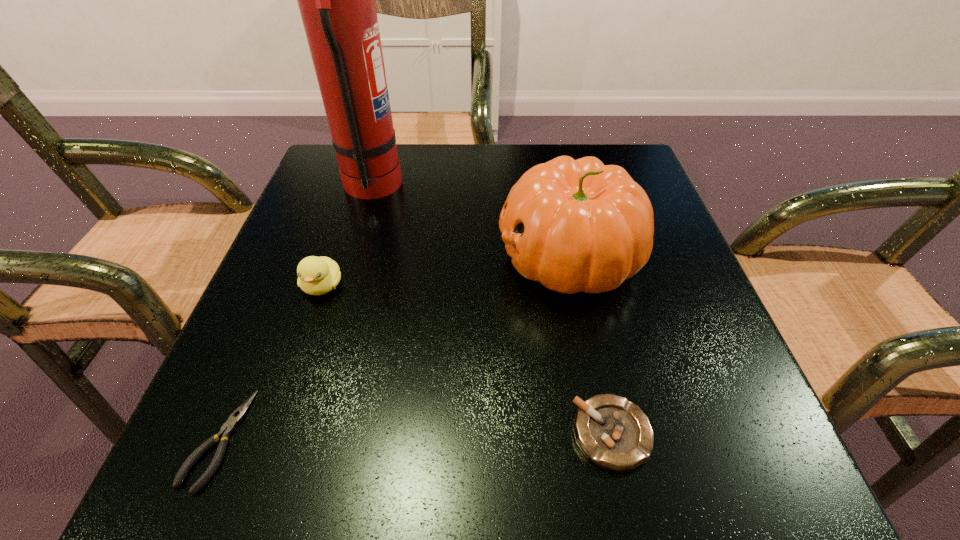
The image size is (960, 540). Find the location of `free space at the far right corner of the desktop`. free space at the far right corner of the desktop is located at coordinates (587, 152).

The image size is (960, 540). What are the coordinates of `vacant space at the near right corner of the desktop` in the screenshot? It's located at (672, 462).

This screenshot has height=540, width=960. I want to click on empty space that is in between the shortest object and the farthest object, so click(295, 313).

Identify the location of vacant area that lies between the ashtray and the pliers. (415, 437).

Find the location of a particular element. The width and height of the screenshot is (960, 540). vacant region between the ashtray and the fire extinguisher is located at coordinates (492, 310).

Image resolution: width=960 pixels, height=540 pixels. I want to click on free space between the duckling and the ashtray, so click(467, 360).

At what (x,y) coordinates should I click in order to perform the action: click on vacant space in between the fourth shortest object and the shortest object. Please return your answer as a coordinate pair (x, y). The image size is (960, 540). Looking at the image, I should click on (394, 348).

You are a GUI agent. You are given a task and a screenshot of the screen. Output one action in this format:
    pyautogui.click(x=<x>, y=<y>)
    Task: Click on the empty location between the pumpkin and the fire extinguisher
    
    Given the screenshot: What is the action you would take?
    pyautogui.click(x=470, y=221)

You are a GUI agent. You are given a task and a screenshot of the screen. Output one action in this format:
    pyautogui.click(x=<x>, y=<y>)
    Task: Click on the free spot between the ashtray and the fire extinguisher
    Image resolution: width=960 pixels, height=540 pixels.
    Given the screenshot: What is the action you would take?
    pyautogui.click(x=492, y=310)

Locate an element on the screen. This screenshot has height=540, width=960. vacant space in between the duckling and the pumpkin is located at coordinates (446, 271).